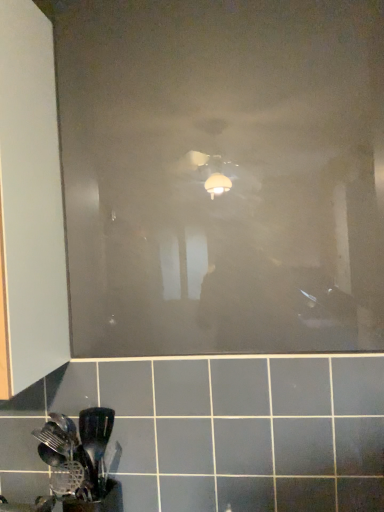
Question: Is matte white cabinet at left smaller than black plastic spatula at lower left?

Choices:
 (A) no
 (B) yes

Answer: (A)

Question: Would you consider matte white cabinet at left to be distant from black plastic spatula at lower left?

Choices:
 (A) yes
 (B) no

Answer: (B)

Question: Is the surface of matte white cabinet at left in direct contact with black plastic spatula at lower left?

Choices:
 (A) yes
 (B) no

Answer: (B)

Question: Is matte white cabinet at left bigger than black plastic spatula at lower left?

Choices:
 (A) no
 (B) yes

Answer: (B)

Question: From a real-world perspective, is matte white cabinet at left below black plastic spatula at lower left?

Choices:
 (A) no
 (B) yes

Answer: (A)

Question: Is the depth of matte white cabinet at left less than that of black plastic spatula at lower left?

Choices:
 (A) no
 (B) yes

Answer: (B)

Question: Considering the relative sizes of black plastic spatula at lower left and matte white cabinet at left in the image provided, is black plastic spatula at lower left taller than matte white cabinet at left?

Choices:
 (A) no
 (B) yes

Answer: (A)

Question: From a real-world perspective, does black plastic spatula at lower left stand above matte white cabinet at left?

Choices:
 (A) no
 (B) yes

Answer: (A)

Question: Is black plastic spatula at lower left smaller than matte white cabinet at left?

Choices:
 (A) yes
 (B) no

Answer: (A)

Question: Considering the relative sizes of black plastic spatula at lower left and matte white cabinet at left in the image provided, is black plastic spatula at lower left thinner than matte white cabinet at left?

Choices:
 (A) yes
 (B) no

Answer: (A)

Question: Is black plastic spatula at lower left aimed at matte white cabinet at left?

Choices:
 (A) yes
 (B) no

Answer: (B)

Question: Is black plastic spatula at lower left in contact with matte white cabinet at left?

Choices:
 (A) yes
 (B) no

Answer: (B)

Question: Is transparent matte glass door at center at the right side of black plastic spatula at lower left?

Choices:
 (A) no
 (B) yes

Answer: (B)